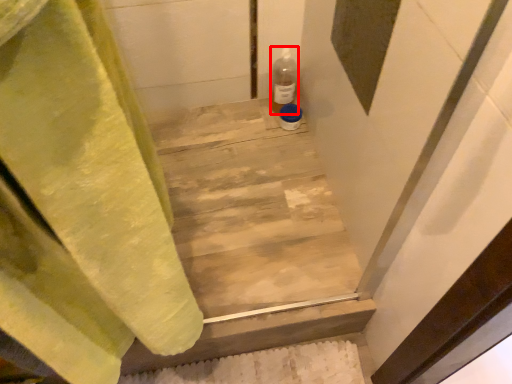
Question: In this image, where is bottle (annotated by the red box) located relative to stairwell?

Choices:
 (A) right
 (B) left

Answer: (A)